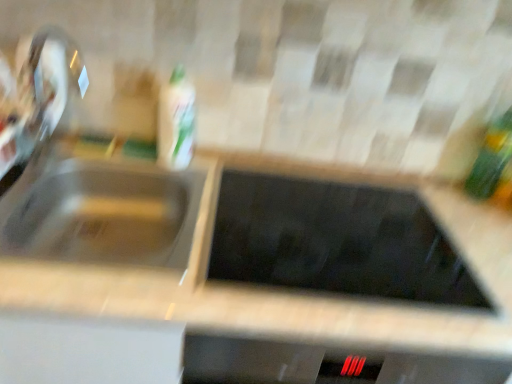
Find the location of a particular element. vacant space to the right of white glossy bottle at upper center, marked as the second bottle in a right-to-left arrangement is located at coordinates (224, 158).